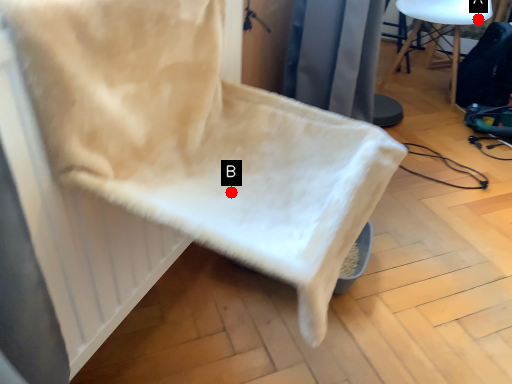
Question: Two points are circled on the image, labeled by A and B beside each circle. Which point is farther to the camera?

Choices:
 (A) A is further
 (B) B is further

Answer: (A)